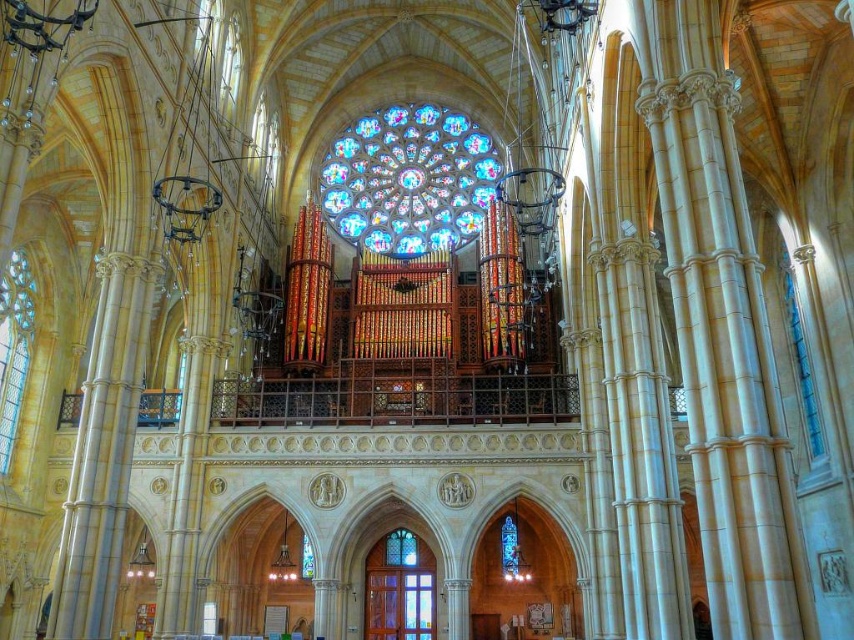
Looking at this image, does stained glass at center have a larger size compared to clear stained glass at left?

Indeed, stained glass at center has a larger size compared to clear stained glass at left.

Who is positioned more to the left, stained glass at center or clear stained glass at left?

clear stained glass at left is more to the left.

Is point (431, 214) behind point (22, 260)?

Yes.

Locate an element on the screen. This screenshot has height=640, width=854. stained glass at center is located at coordinates (408, 179).

Is translucent wooden door at lower center wider than clear stained glass at left?

Correct, the width of translucent wooden door at lower center exceeds that of clear stained glass at left.

Can you confirm if translucent wooden door at lower center is taller than clear stained glass at left?

No.

Is point (367, 624) more distant than point (12, 426)?

Yes, it is.

I want to click on translucent wooden door at lower center, so click(x=399, y=588).

Is stained glass at center behind translucent wooden door at lower center?

Yes, stained glass at center is further from the viewer.

Between point (342, 177) and point (424, 580), which one is positioned behind?

Point (342, 177)

Is point (346, 236) more distant than point (373, 609)?

Yes, point (346, 236) is behind point (373, 609).

What are the coordinates of `stained glass at center` in the screenshot? It's located at (408, 179).